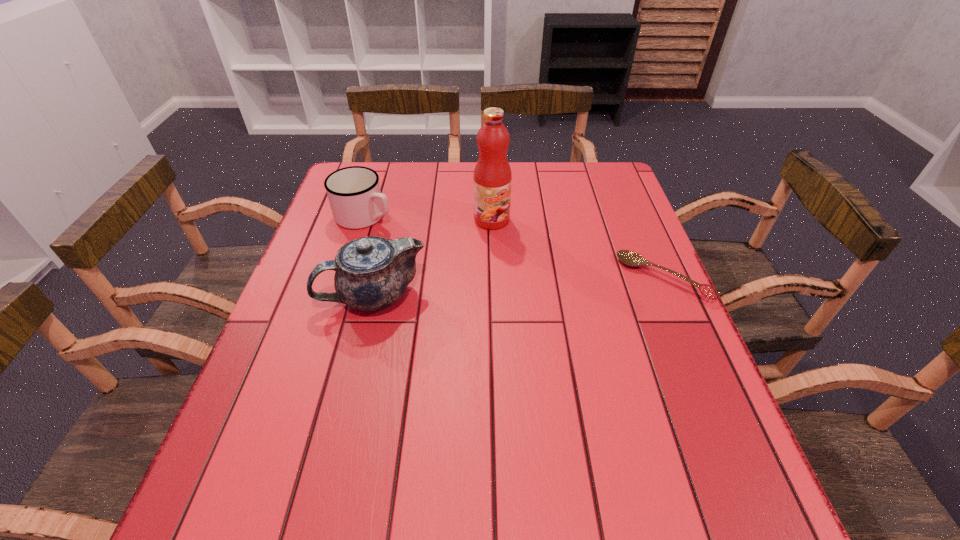
The image size is (960, 540). Identify the location of blank space at the near edge of the desktop. (502, 439).

The image size is (960, 540). Identify the location of vacant region at the left edge. tap(330, 324).

Locate an element on the screen. The width and height of the screenshot is (960, 540). vacant point at the right edge is located at coordinates (591, 208).

You are a GUI agent. You are given a task and a screenshot of the screen. Output one action in this format:
    pyautogui.click(x=<x>, y=<y>)
    Task: Click on the vacant space at the near left corner of the desktop
    
    Given the screenshot: What is the action you would take?
    pyautogui.click(x=253, y=420)

Locate an element on the screen. Image resolution: width=960 pixels, height=540 pixels. vacant space at the near right corner of the desktop is located at coordinates (673, 416).

What are the coordinates of `vacant space that's between the third tallest object and the third object from left to right` in the screenshot? It's located at (428, 218).

You are a GUI agent. You are given a task and a screenshot of the screen. Output one action in this format:
    pyautogui.click(x=<x>, y=<y>)
    Task: Click on the free spot between the chinaware and the shortest object
    This screenshot has width=960, height=540.
    Given the screenshot: What is the action you would take?
    [x=518, y=287]

At what (x,y) coordinates should I click in order to perform the action: click on vacant area between the ladle and the third object from left to right. Please return your answer as a coordinate pair (x, y). The height and width of the screenshot is (540, 960). Looking at the image, I should click on (578, 249).

At what (x,y) coordinates should I click in order to perform the action: click on vacant area that lies between the third shortest object and the fruit juice. Please return your answer as a coordinate pair (x, y). Looking at the image, I should click on (432, 258).

Where is `vacant space that is in between the mug and the rightmost object`? vacant space that is in between the mug and the rightmost object is located at coordinates (515, 247).